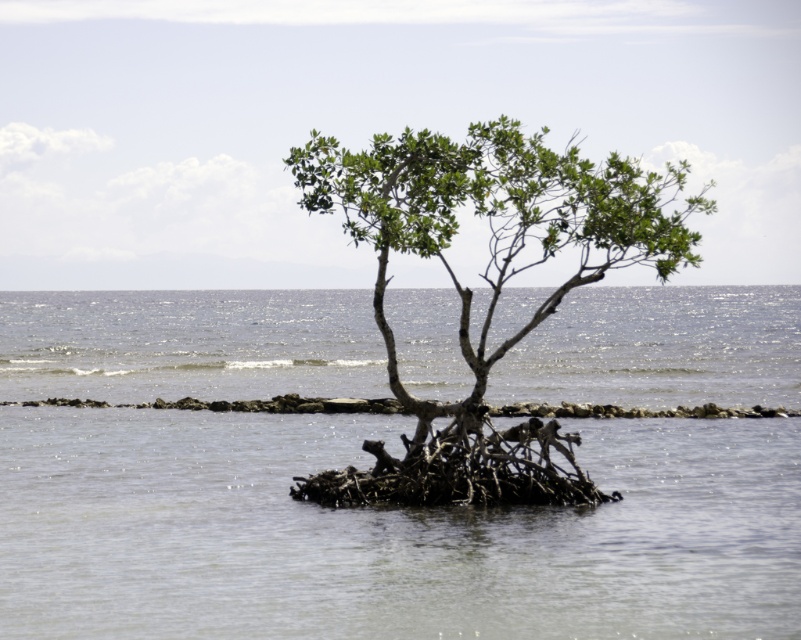
You are standing on the rocky barrier in the background and want to reach the mangrove tree. There is clear water at center. Which direction should you move to reach the mangrove tree?

You should move towards the clear water at center, as it is located at point (385,532), which is the area between the rocky barrier and the mangrove tree. Moving towards this clear water will guide you directly towards the mangrove tree.